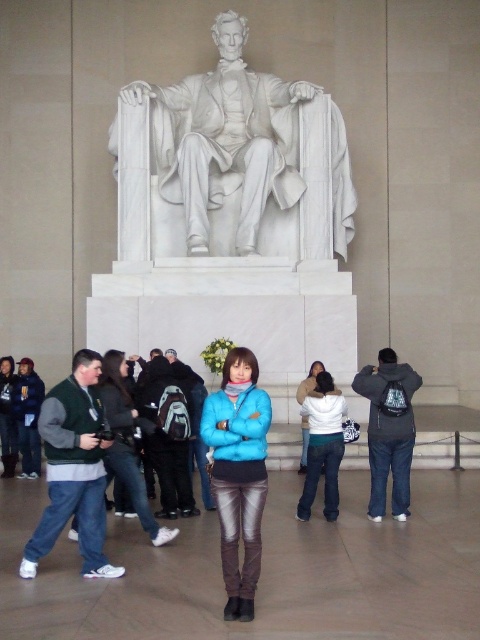
Does dark gray backpack at center have a greater width compared to dark green sweater at left?

Yes.

Can you confirm if dark gray backpack at center is positioned to the right of dark green sweater at left?

Indeed, dark gray backpack at center is positioned on the right side of dark green sweater at left.

Is point (374, 516) less distant than point (29, 424)?

Yes, point (374, 516) is closer to viewer.

At what (x,y) coordinates should I click in order to perform the action: click on dark gray backpack at center. Please return your answer as a coordinate pair (x, y). Looking at the image, I should click on (388, 429).

Between dark gray backpack at center and green fleece jacket at center, which one appears on the right side from the viewer's perspective?

dark gray backpack at center is more to the right.

The image size is (480, 640). In order to click on dark gray backpack at center in this screenshot , I will do `click(388, 429)`.

Who is more forward, (249,227) or (395,387)?

Positioned in front is point (395,387).

Between white marble statue at center and dark gray backpack at center, which one has more height?

Standing taller between the two is white marble statue at center.

Does point (343, 232) come in front of point (384, 349)?

That is False.

Identify the location of white marble statue at center. (236, 161).